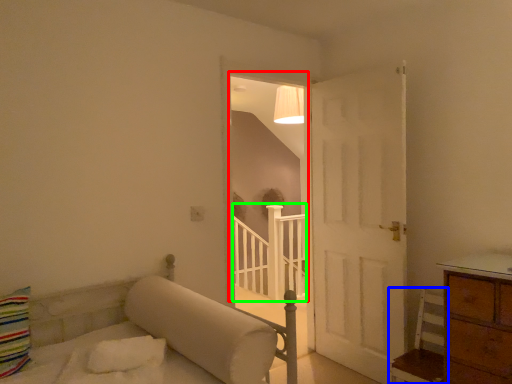
Question: Estimate the real-world distances between objects in this image. Which object is closer to window (highlighted by a red box), furniture (highlighted by a blue box) or balustrade (highlighted by a green box)?

Choices:
 (A) furniture
 (B) balustrade

Answer: (B)